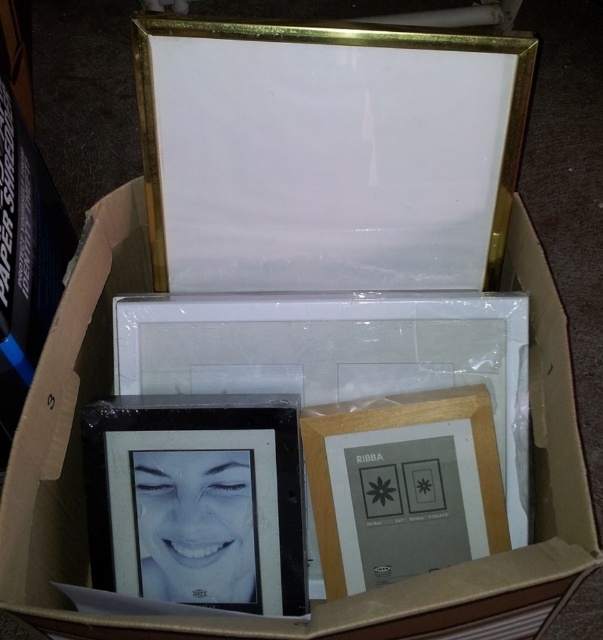
Does matte white cardboard box at center appear on the left side of black glossy photo frame at lower left?

Incorrect, matte white cardboard box at center is not on the left side of black glossy photo frame at lower left.

Find the location of `matte white cardboard box at center`. matte white cardboard box at center is located at coordinates 320,604.